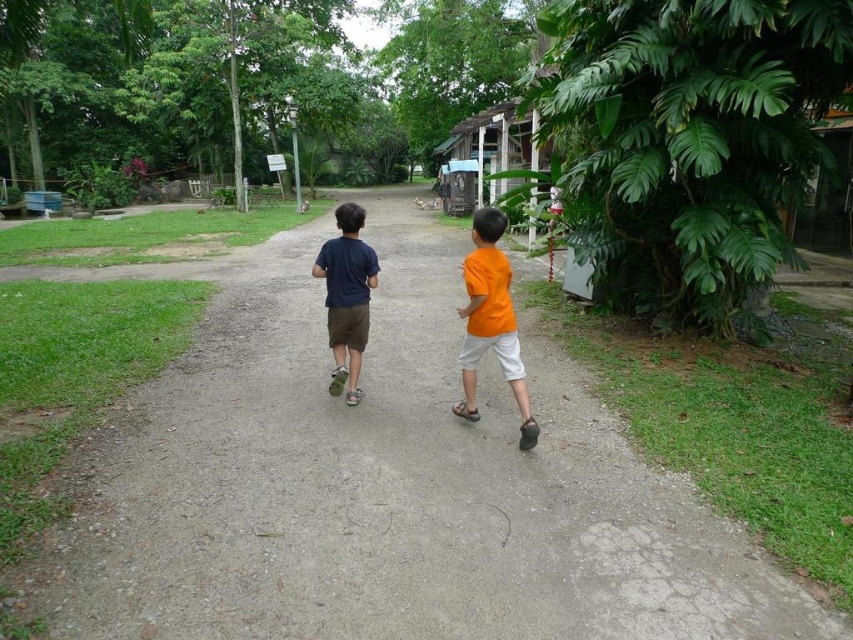
Question: Among these objects, which one is farthest from the camera?

Choices:
 (A) orange matte shirt at center
 (B) matte blue shirt at center
 (C) gray gravel path at center

Answer: (B)

Question: Which point is farther to the camera?

Choices:
 (A) (503, 349)
 (B) (250, 456)
 (C) (328, 241)

Answer: (C)

Question: Among these points, which one is nearest to the camera?

Choices:
 (A) (349, 333)
 (B) (405, 483)
 (C) (503, 358)

Answer: (B)

Question: Can you confirm if orange matte shirt at center is smaller than matte blue shirt at center?

Choices:
 (A) yes
 (B) no

Answer: (B)

Question: Where is gray gravel path at center located in relation to orange matte shirt at center in the image?

Choices:
 (A) right
 (B) left

Answer: (B)

Question: Is gray gravel path at center to the left of orange matte shirt at center from the viewer's perspective?

Choices:
 (A) no
 (B) yes

Answer: (B)